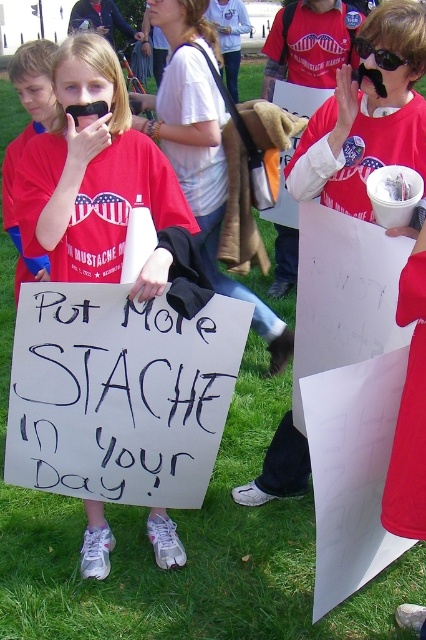
Is matte red t-shirt at center to the right of white paper sign at center from the viewer's perspective?

Incorrect, matte red t-shirt at center is not on the right side of white paper sign at center.

Which is behind, point (115, 276) or point (408, 0)?

The point (115, 276) is more distant.

Locate an element on the screen. The width and height of the screenshot is (426, 640). matte red t-shirt at center is located at coordinates (92, 172).

Is white paper sign at center taller than black plastic goggles at upper center?

Correct, white paper sign at center is much taller as black plastic goggles at upper center.

Who is taller, white paper sign at center or black plastic goggles at upper center?

Standing taller between the two is white paper sign at center.

Is point (414, 22) farther from camera compared to point (388, 67)?

No.

Locate an element on the screen. The image size is (426, 640). white paper sign at center is located at coordinates (367, 116).

Who is more distant from viewer, (78, 202) or (388, 67)?

Point (78, 202)

Does matte red t-shirt at center have a lesser height compared to black plastic goggles at upper center?

Incorrect, matte red t-shirt at center's height does not fall short of black plastic goggles at upper center's.

Find the location of a particular element. Image resolution: width=426 pixels, height=640 pixels. matte red t-shirt at center is located at coordinates (92, 172).